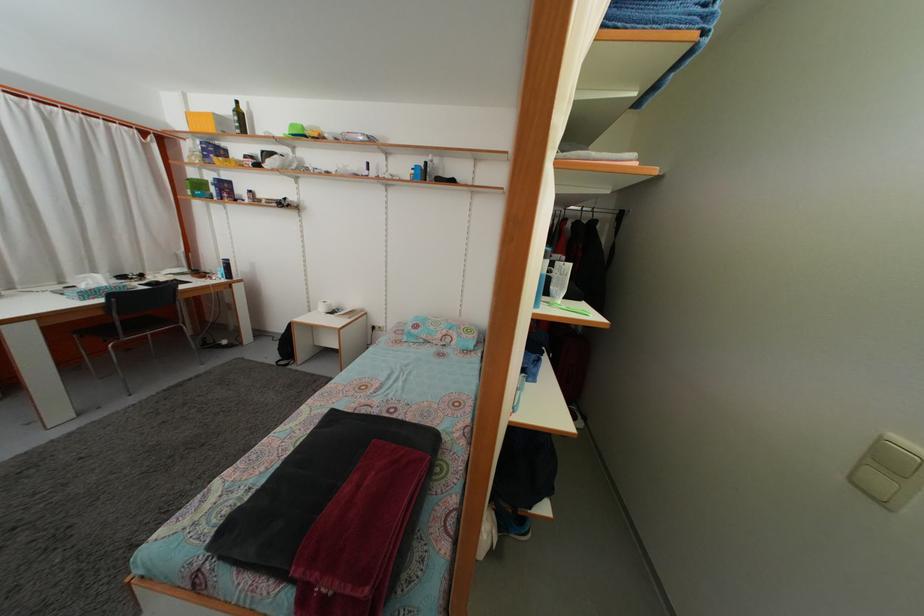
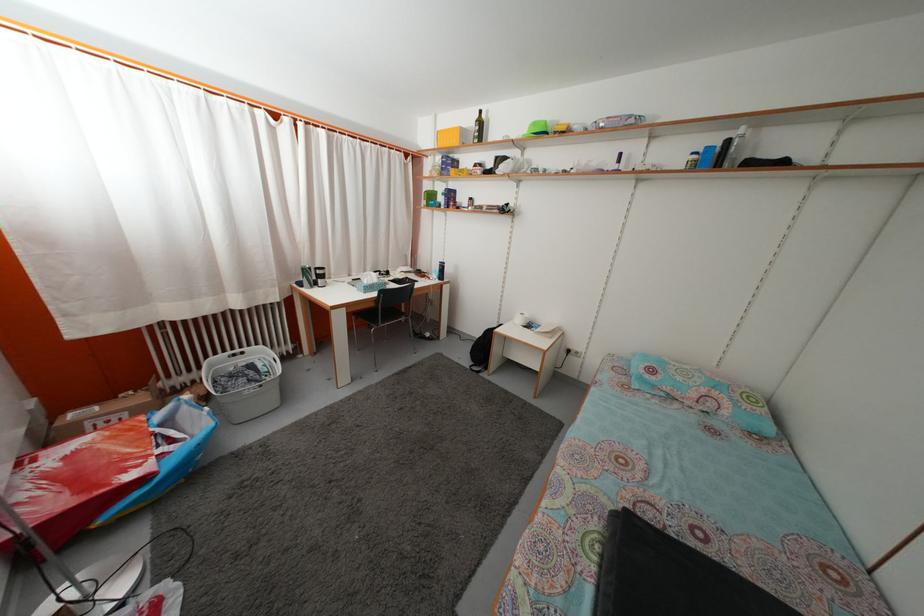
The point at (228, 116) is marked in the first image. Where is the corresponding point in the second image?

(475, 127)